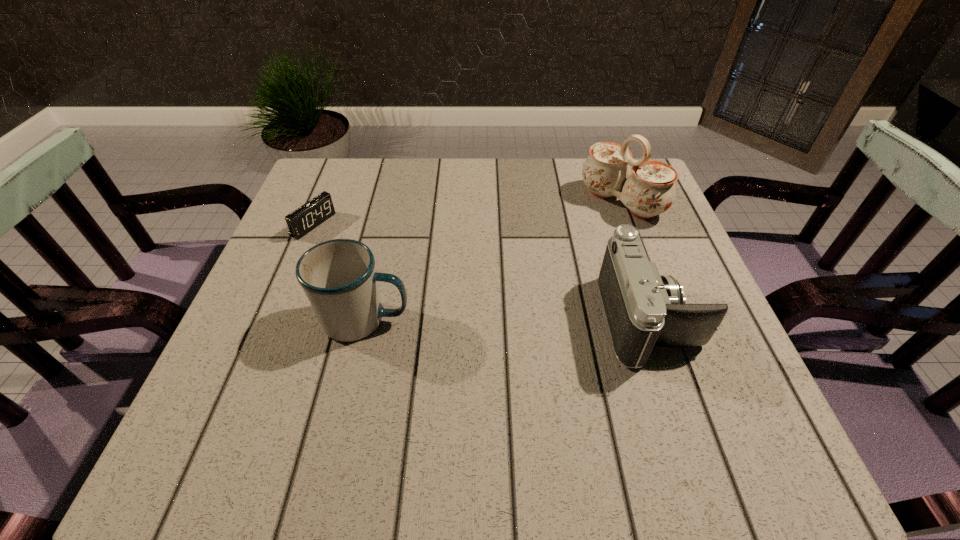
In order to click on vacant region that satisfies the following two spatial constraints: 1. on the front side of the third object from right to left; 2. on the handle side of the leftmost object in this screenshot , I will do `click(274, 320)`.

The height and width of the screenshot is (540, 960). What are the coordinates of `vacant space that satisfies the following two spatial constraints: 1. on the front side of the leftmost object; 2. on the handle side of the mug` in the screenshot? It's located at (274, 320).

Where is `free location that satisfies the following two spatial constraints: 1. on the front side of the camera; 2. at the front of the alarm clock with an open lens cover`? The width and height of the screenshot is (960, 540). free location that satisfies the following two spatial constraints: 1. on the front side of the camera; 2. at the front of the alarm clock with an open lens cover is located at coordinates (274, 320).